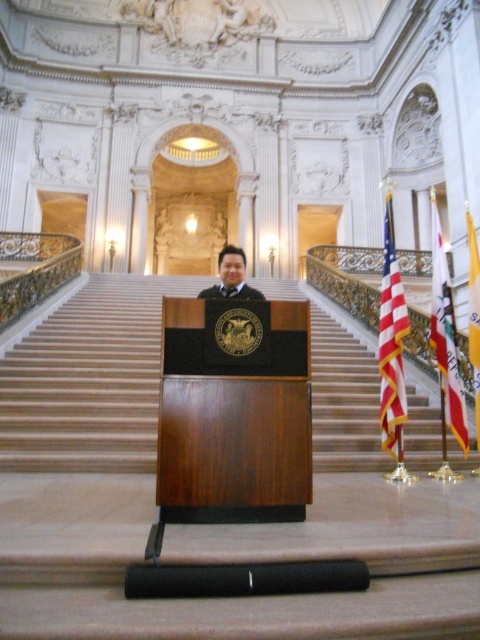
Can you confirm if wooden staircase at center is positioned to the right of dark brown suit at center?

Correct, you'll find wooden staircase at center to the right of dark brown suit at center.

Is wooden staircase at center bigger than dark brown suit at center?

No.

Image resolution: width=480 pixels, height=640 pixels. I want to click on wooden staircase at center, so click(x=88, y=380).

Who is positioned more to the left, silky yellow flag at right or dark brown suit at center?

dark brown suit at center

What do you see at coordinates (445, 337) in the screenshot? This screenshot has height=640, width=480. I see `silky yellow flag at right` at bounding box center [445, 337].

Is point (434, 316) more distant than point (229, 294)?

Yes, it is behind point (229, 294).

Identify the location of silky yellow flag at right. Image resolution: width=480 pixels, height=640 pixels. (445, 337).

Locate an element on the screen. The width and height of the screenshot is (480, 640). american flag at right is located at coordinates (392, 344).

Who is lower down, american flag at right or dark brown suit at center?

dark brown suit at center is below.

Where is `american flag at right`? american flag at right is located at coordinates (392, 344).